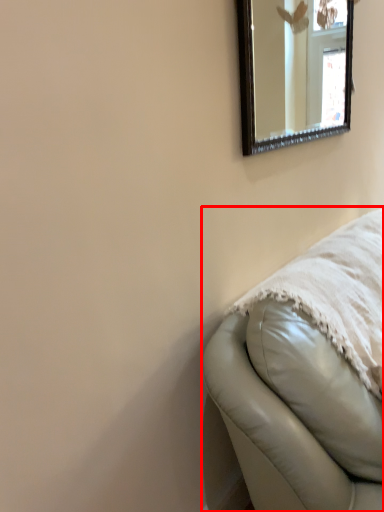
Question: Where is furniture (annotated by the red box) located in relation to mirror in the image?

Choices:
 (A) left
 (B) right

Answer: (B)